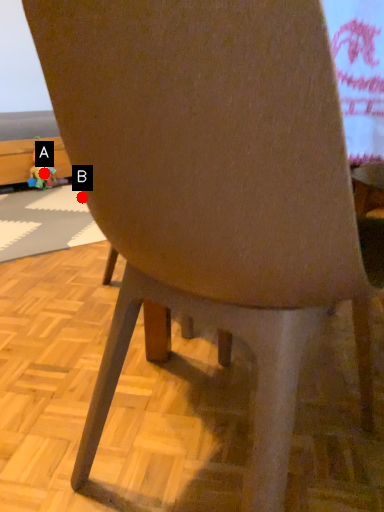
Question: Two points are circled on the image, labeled by A and B beside each circle. Which point appears farthest from the camera in this image?

Choices:
 (A) A is further
 (B) B is further

Answer: (A)